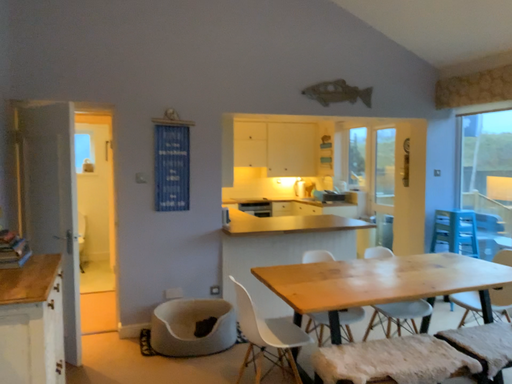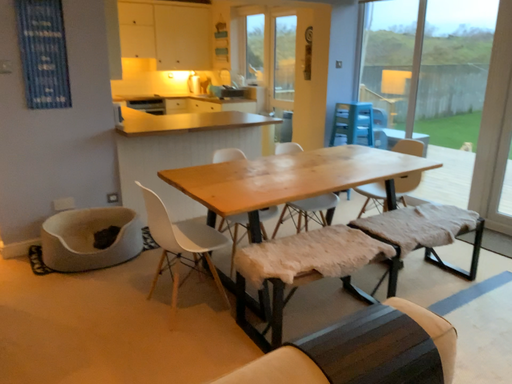
Question: Which way did the camera rotate in the video?

Choices:
 (A) rotated upward
 (B) rotated downward

Answer: (B)